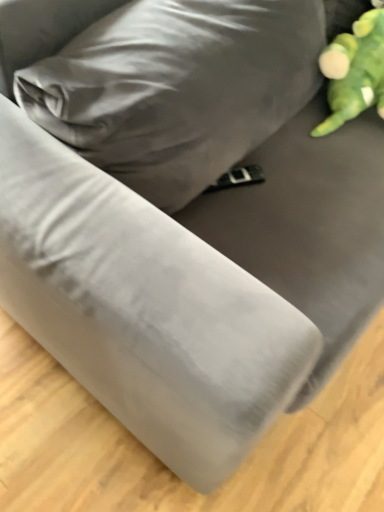
What do you see at coordinates (354, 71) in the screenshot?
I see `green plush toy at upper right` at bounding box center [354, 71].

Identify the location of green plush toy at upper right. The height and width of the screenshot is (512, 384). [x=354, y=71].

Locate an element on the screen. green plush toy at upper right is located at coordinates (354, 71).